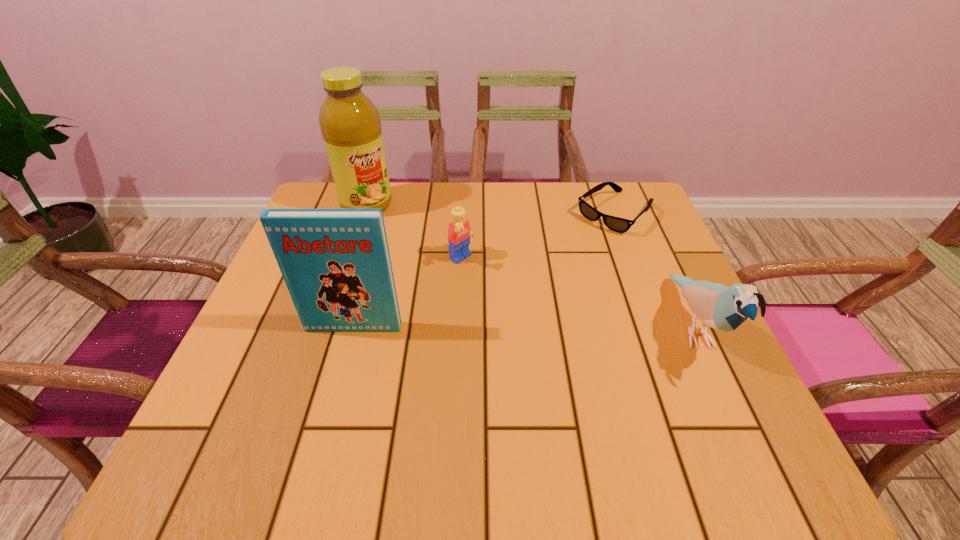
Locate an element on the screen. The width and height of the screenshot is (960, 540). the fourth shortest object is located at coordinates (336, 264).

Locate an element on the screen. bird is located at coordinates (720, 307).

This screenshot has width=960, height=540. I want to click on the tallest object, so click(x=350, y=124).

Where is `sunglasses`? This screenshot has height=540, width=960. sunglasses is located at coordinates (617, 224).

Where is `Lego`? Image resolution: width=960 pixels, height=540 pixels. Lego is located at coordinates (459, 233).

You are a GUI agent. You are given a task and a screenshot of the screen. Output one action in this format:
    pyautogui.click(x=<x>, y=<y>)
    Task: Click on the third object from left to right
    
    Given the screenshot: What is the action you would take?
    pos(459,233)

The image size is (960, 540). Identify the location of vacant region located 0.130m on the front cover of the second tallest object. (337, 389).

This screenshot has height=540, width=960. What are the coordinates of `vacant space situated at the face of the bird` in the screenshot? It's located at (734, 417).

At what (x,y) coordinates should I click in order to perform the action: click on vacant area situated on the front label of the tallest object. Please return your answer as a coordinate pair (x, y). Looking at the image, I should click on (420, 262).

You are a GUI agent. You are given a task and a screenshot of the screen. Output one action in this format:
    pyautogui.click(x=<x>, y=<y>)
    Task: Click on the vacant space situated 0.250m on the front label of the tallest object
    The image size is (960, 540).
    Given the screenshot: What is the action you would take?
    click(425, 269)